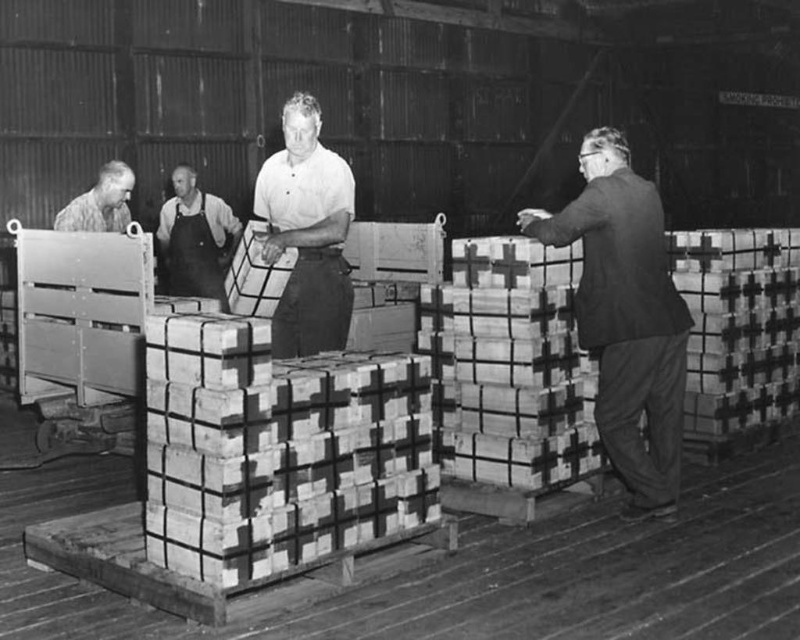
Question: Which of the following is the farthest from the observer?

Choices:
 (A) smooth dark suit at right
 (B) dark gray apron at center
 (C) brushed metal shirt at left

Answer: (B)

Question: Does dark gray apron at center lie behind brushed metal shirt at left?

Choices:
 (A) no
 (B) yes

Answer: (B)

Question: Which of these objects is positioned farthest from the smooth dark suit at right?

Choices:
 (A) dark gray apron at center
 (B) smooth white shirt at center
 (C) brushed metal shirt at left

Answer: (A)

Question: Is smooth dark suit at right closer to camera compared to smooth white shirt at center?

Choices:
 (A) yes
 (B) no

Answer: (A)

Question: In this image, where is smooth white shirt at center located relative to dark gray apron at center?

Choices:
 (A) left
 (B) right

Answer: (B)

Question: Estimate the real-world distances between objects in this image. Which object is farther from the dark gray apron at center?

Choices:
 (A) brushed metal shirt at left
 (B) smooth white shirt at center

Answer: (B)